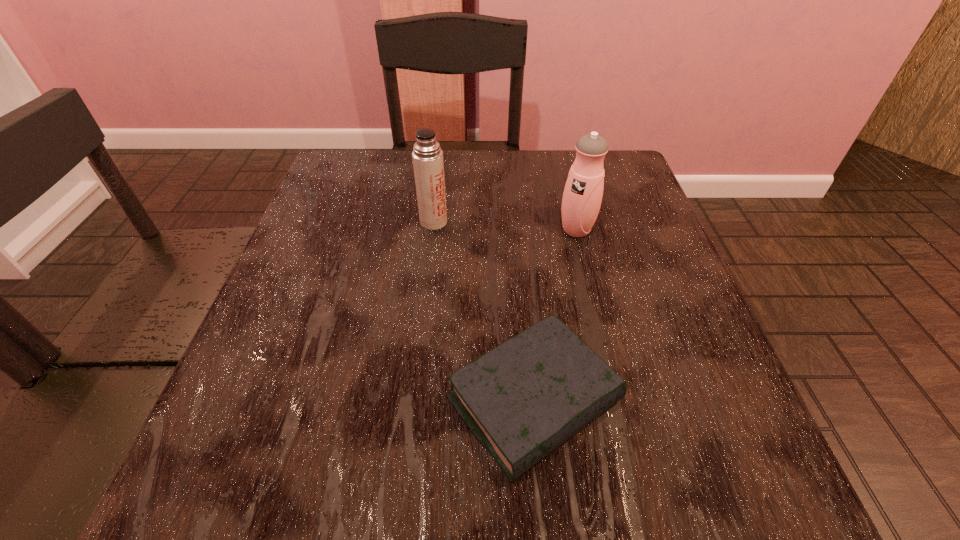
This screenshot has height=540, width=960. Identify the location of vacant area that lies between the right thermos bottle and the left thermos bottle. tap(505, 226).

Identify the location of vacant area that lies between the leftmost object and the right thermos bottle. (505, 226).

The image size is (960, 540). I want to click on vacant area that lies between the leftmost object and the right thermos bottle, so click(505, 226).

Locate an element on the screen. the second closest object to the right thermos bottle is located at coordinates (521, 400).

Identify which object is the closest to the left thermos bottle. Please provide its 2D coordinates. Your answer should be formatted as a tuple, i.e. [(x, y)], where the tuple contains the x and y coordinates of a point satisfying the conditions above.

[(582, 196)]

Where is `free spot that satisfies the following two spatial constraints: 1. on the back side of the nearest object; 2. on the right side of the right thermos bottle`? Image resolution: width=960 pixels, height=540 pixels. free spot that satisfies the following two spatial constraints: 1. on the back side of the nearest object; 2. on the right side of the right thermos bottle is located at coordinates (517, 230).